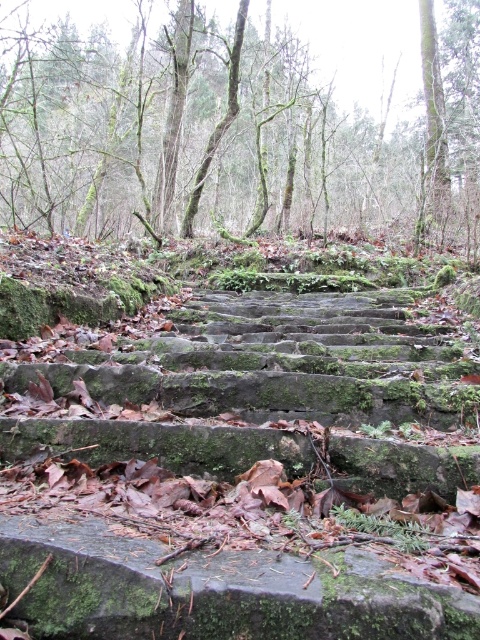
You are standing at the base of the mossy stone stairs at center and want to take a photo of them with your camera. Given that the camera requires a minimum distance of 3 feet to focus properly, will you be able to take a clear photo without moving closer or farther away?

The mossy stone stairs at center and camera are 3.44 feet apart from each other. Since 3.44 feet is greater than the minimum required 3 feet, you can take a clear photo without moving.

You are standing at the bottom of the mossy stone stairs at center. If you walk straight ahead, will you stay on the stairs or step onto the surrounding forest ground?

The mossy stone stairs at center are located at point (245, 477), so if you walk straight ahead from the bottom, you will stay on the stairs since they are centered in the image.